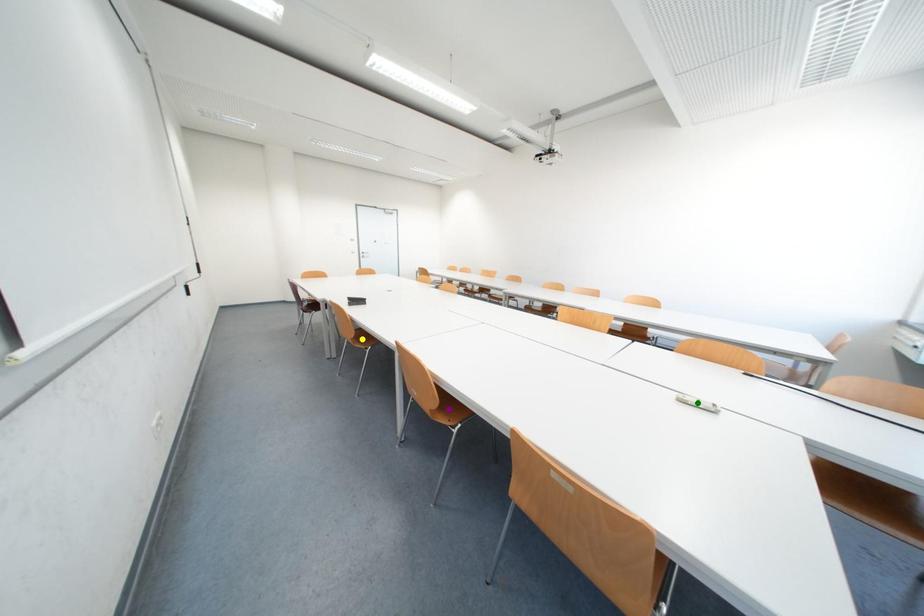
Order these from nearest to farthest:
1. green point
2. purple point
3. yellow point

green point → purple point → yellow point